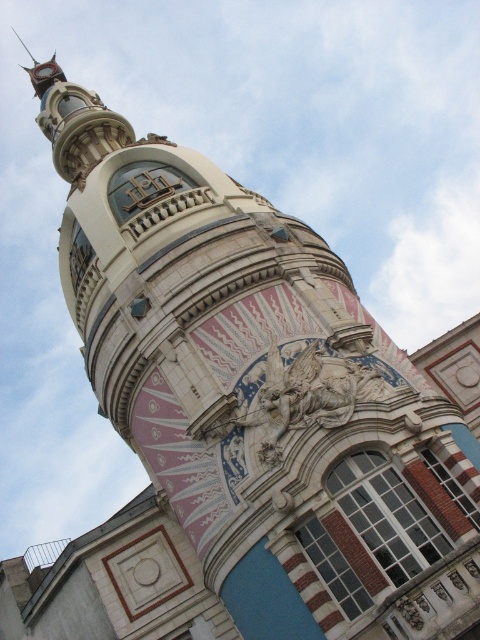
Question: Is carved stone sculpture at center bigger than polished brass clock at upper left?

Choices:
 (A) no
 (B) yes

Answer: (A)

Question: Does carved stone sculpture at center appear over polished brass clock at upper left?

Choices:
 (A) yes
 (B) no

Answer: (B)

Question: Which point appears farthest from the camera in this image?

Choices:
 (A) (326, 355)
 (B) (48, 65)

Answer: (B)

Question: Does carved stone sculpture at center have a greater width compared to polished brass clock at upper left?

Choices:
 (A) yes
 (B) no

Answer: (B)